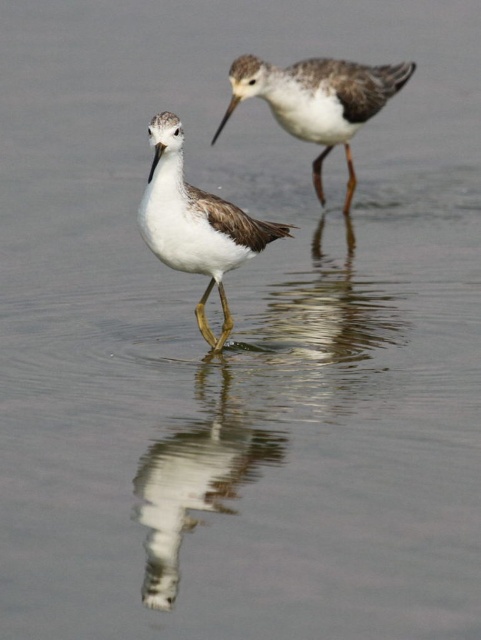
You are a birdwatcher trying to capture both birds in a single photo. Based on their positions in the image, which bird, the white matte bird at center or the white matte bird at upper center, would appear smaller in the photo?

The white matte bird at center would appear smaller in the photo because it occupies less space in the image compared to the white matte bird at upper center.

You are a photographer trying to capture both birds in a single frame. Given that the white glossy bird reflection at center and the white matte bird at center are both in the scene, which one would you focus on first to ensure it takes up more of the frame?

The white matte bird at center occupies more space than the white glossy bird reflection at center, so focusing on the white matte bird at center first would ensure it takes up more of the frame.